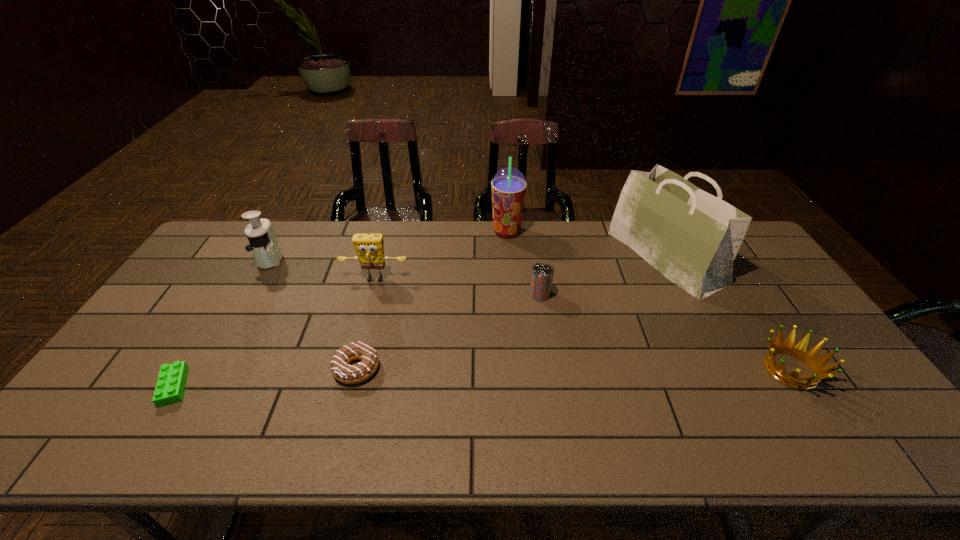
Locate an element on the screen. vacant point located between the smoothie and the grocery bag is located at coordinates (587, 244).

Where is `free space between the crown and the smoothie`? This screenshot has width=960, height=540. free space between the crown and the smoothie is located at coordinates (649, 301).

Locate an element on the screen. Image resolution: width=960 pixels, height=540 pixels. free spot between the sponge and the second shortest object is located at coordinates (366, 324).

Where is `vacant area between the second shortest object and the beer can`? The image size is (960, 540). vacant area between the second shortest object and the beer can is located at coordinates (448, 331).

The width and height of the screenshot is (960, 540). I want to click on free space between the third shortest object and the fifth tallest object, so click(665, 332).

Locate an element on the screen. This screenshot has height=540, width=960. vacant area that lies between the second shortest object and the sponge is located at coordinates (366, 324).

Find the location of a particular element. The height and width of the screenshot is (540, 960). vacant space that's between the beer can and the juicer is located at coordinates (405, 277).

Where is `vacant region between the crown and the Lego`? vacant region between the crown and the Lego is located at coordinates (482, 378).

This screenshot has width=960, height=540. I want to click on the third closest object to the smoothie, so click(x=369, y=247).

Image resolution: width=960 pixels, height=540 pixels. Identify the location of object that is the second closest to the doughnut. (170, 386).